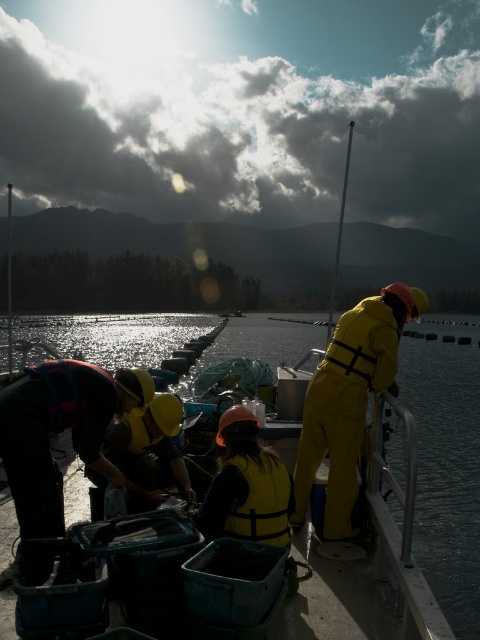
Which is in front, point (352, 387) or point (239, 456)?

Point (239, 456) is more forward.

What do you see at coordinates (348, 400) in the screenshot?
I see `yellow rubber suit at right` at bounding box center [348, 400].

Locate an element on the screen. The width and height of the screenshot is (480, 640). yellow rubber suit at right is located at coordinates (348, 400).

Between yellow matte life vest at center and yellow matte safety vest at center, which one has less height?

yellow matte safety vest at center is shorter.

Between point (168, 444) and point (276, 532), which one is positioned behind?

The point (168, 444) is behind.

Where is `yellow matte life vest at center`? The width and height of the screenshot is (480, 640). yellow matte life vest at center is located at coordinates (148, 452).

Who is taller, clear water at center or yellow rubber suit at right?

clear water at center is taller.

Does clear water at center have a larger size compared to yellow rubber suit at right?

Indeed, clear water at center has a larger size compared to yellow rubber suit at right.

Does point (268, 346) lie behind point (312, 481)?

Yes, point (268, 346) is behind point (312, 481).

Image resolution: width=480 pixels, height=640 pixels. In order to click on clear water at center in this screenshot , I will do `click(446, 464)`.